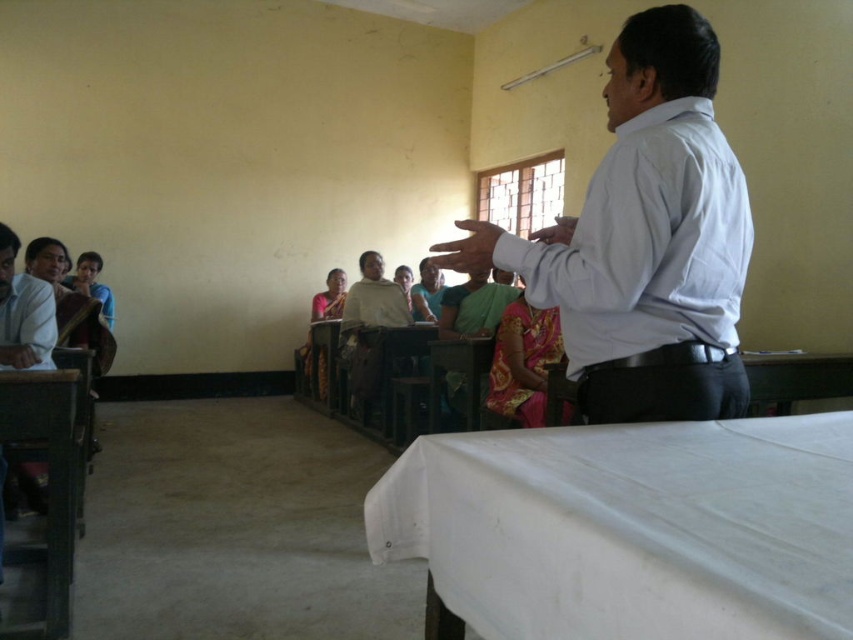
Does white fabric table at lower right appear on the right side of light brown wooden desk at left?

Indeed, white fabric table at lower right is positioned on the right side of light brown wooden desk at left.

Is white fabric table at lower right taller than light brown wooden desk at left?

Incorrect, white fabric table at lower right's height is not larger of light brown wooden desk at left's.

The height and width of the screenshot is (640, 853). Identify the location of white fabric table at lower right. (631, 529).

Which is in front, point (15, 435) or point (28, 355)?

Point (15, 435) is more forward.

Find the location of a particular element. The width and height of the screenshot is (853, 640). wooden table at lower left is located at coordinates (50, 481).

Measure the distance from white fabric table at lower right to white shirt at upper right.

white fabric table at lower right is 15.99 inches away from white shirt at upper right.

Which of these two, white fabric table at lower right or white shirt at upper right, stands shorter?

white fabric table at lower right

Where is `white fabric table at lower right`? The height and width of the screenshot is (640, 853). white fabric table at lower right is located at coordinates (631, 529).